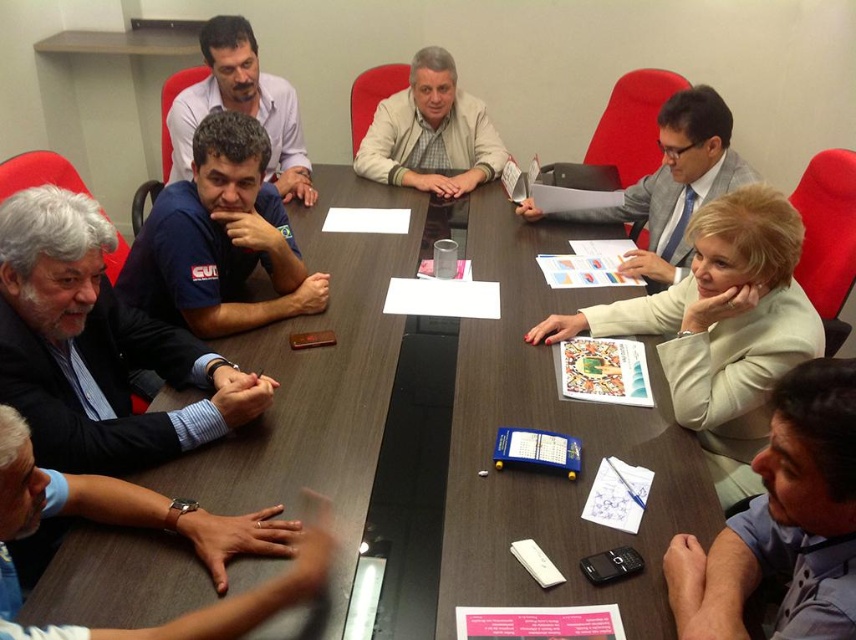
Between dark wood table at center and blue fabric shirt at left, which one is positioned lower?

dark wood table at center is below.

The image size is (856, 640). Find the location of `dark wood table at center`. dark wood table at center is located at coordinates (550, 429).

Where is `dark wood table at center`? This screenshot has width=856, height=640. dark wood table at center is located at coordinates (550, 429).

Where is `dark wood table at center`? The width and height of the screenshot is (856, 640). dark wood table at center is located at coordinates (550, 429).

Can you confirm if gray shirt at upper right is positioned to the right of blue fabric shirt at left?

Indeed, gray shirt at upper right is positioned on the right side of blue fabric shirt at left.

Which is behind, point (749, 516) or point (215, 154)?

The point (215, 154) is behind.

What do you see at coordinates (783, 522) in the screenshot? I see `gray shirt at upper right` at bounding box center [783, 522].

Locate an element on the screen. gray shirt at upper right is located at coordinates (783, 522).

Is gray hair man at left smaller than light beige fabric jacket at right?

Yes, gray hair man at left is smaller than light beige fabric jacket at right.

Which is in front, point (179, 429) or point (755, 240)?

Positioned in front is point (755, 240).

Which is in front, point (91, 467) or point (773, 294)?

Point (91, 467) is in front.

Where is `gray hair man at left`? gray hair man at left is located at coordinates (97, 348).